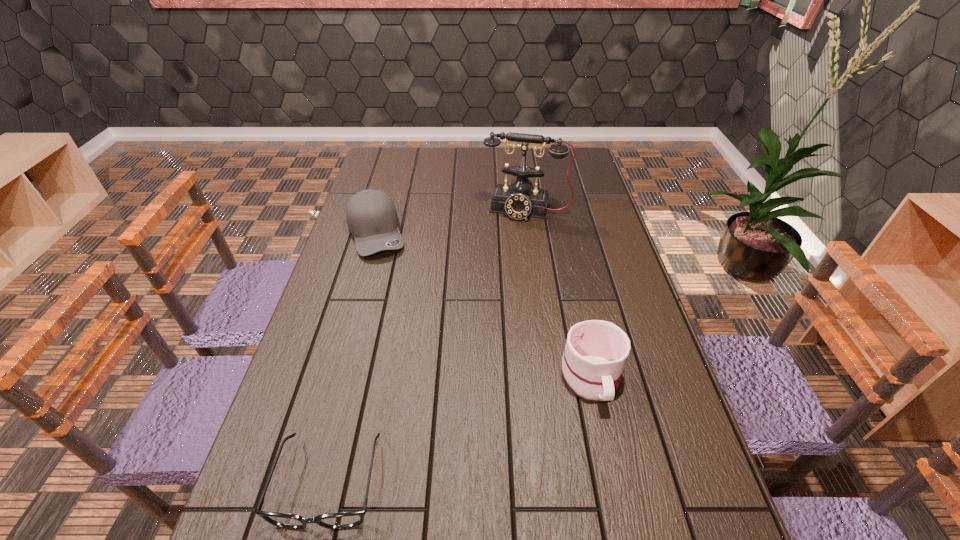
Where is `free space between the third farthest object and the telephone`? free space between the third farthest object and the telephone is located at coordinates (559, 293).

Where is `vacant space that is in between the shortest object and the third farthest object`? The width and height of the screenshot is (960, 540). vacant space that is in between the shortest object and the third farthest object is located at coordinates (460, 429).

Locate an element on the screen. Image resolution: width=960 pixels, height=540 pixels. vacant area that lies between the telephone and the baseball cap is located at coordinates (451, 221).

Select which object appears as the second closest to the third farthest object. Please provide its 2D coordinates. Your answer should be formatted as a tuple, i.e. [(x, y)], where the tuple contains the x and y coordinates of a point satisfying the conditions above.

[(520, 200)]

Select which object is the closest to the baseball cap. Please provide its 2D coordinates. Your answer should be formatted as a tuple, i.e. [(x, y)], where the tuple contains the x and y coordinates of a point satisfying the conditions above.

[(520, 200)]

At what (x,y) coordinates should I click in order to perform the action: click on free location that satisfies the following two spatial constraints: 1. on the back side of the tallest object; 2. on the right side of the baseball cap. Please return your answer as a coordinate pair (x, y). The height and width of the screenshot is (540, 960). Looking at the image, I should click on (383, 210).